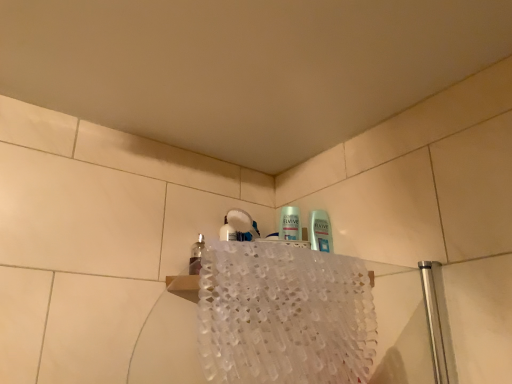
Question: Relative to white lace bath towel at upper center, is transparent glass mouthwash at upper left in front or behind?

Choices:
 (A) front
 (B) behind

Answer: (B)

Question: Considering the relative positions of transparent glass mouthwash at upper left and white lace bath towel at upper center in the image provided, is transparent glass mouthwash at upper left to the left or to the right of white lace bath towel at upper center?

Choices:
 (A) right
 (B) left

Answer: (B)

Question: Considering the positions of point (192, 271) and point (268, 377), is point (192, 271) closer or farther from the camera than point (268, 377)?

Choices:
 (A) farther
 (B) closer

Answer: (A)

Question: Relative to transparent glass mouthwash at upper left, is white lace bath towel at upper center in front or behind?

Choices:
 (A) behind
 (B) front

Answer: (B)

Question: Is white lace bath towel at upper center situated inside transparent glass mouthwash at upper left or outside?

Choices:
 (A) inside
 (B) outside

Answer: (B)

Question: From the image's perspective, relative to transparent glass mouthwash at upper left, is white lace bath towel at upper center above or below?

Choices:
 (A) above
 (B) below

Answer: (B)

Question: From a real-world perspective, is white lace bath towel at upper center positioned above or below transparent glass mouthwash at upper left?

Choices:
 (A) below
 (B) above

Answer: (A)